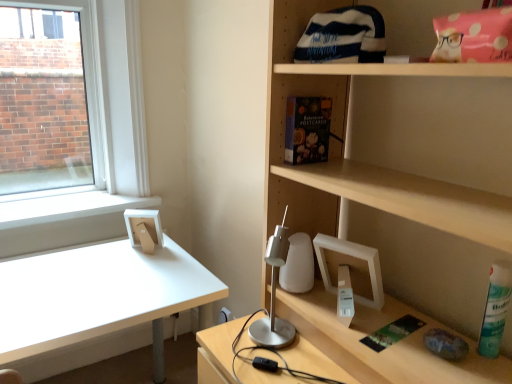
Question: Is point (509, 276) closer or farther from the camera than point (180, 299)?

Choices:
 (A) closer
 (B) farther

Answer: (A)

Question: From a real-world perspective, is green matte spray can at lower right physically located above or below white matte desk at left?

Choices:
 (A) below
 (B) above

Answer: (B)

Question: Estimate the real-world distances between objects in this image. Which object is farther from the white matte desk at left?

Choices:
 (A) matte floral-patterned book at upper center
 (B) green matte spray can at lower right

Answer: (B)

Question: Which of these objects is positioned closest to the matte floral-patterned book at upper center?

Choices:
 (A) green matte spray can at lower right
 (B) white matte desk at left

Answer: (A)